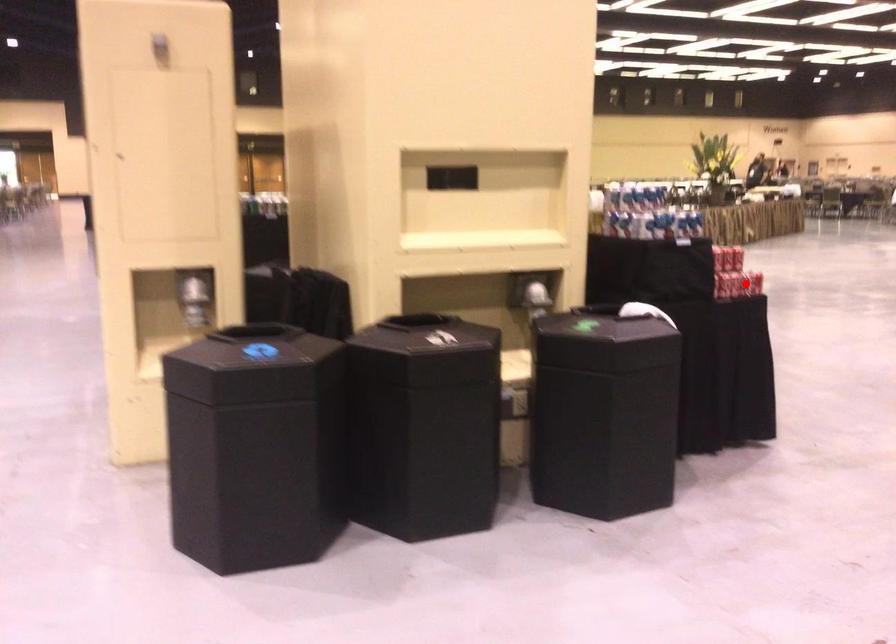
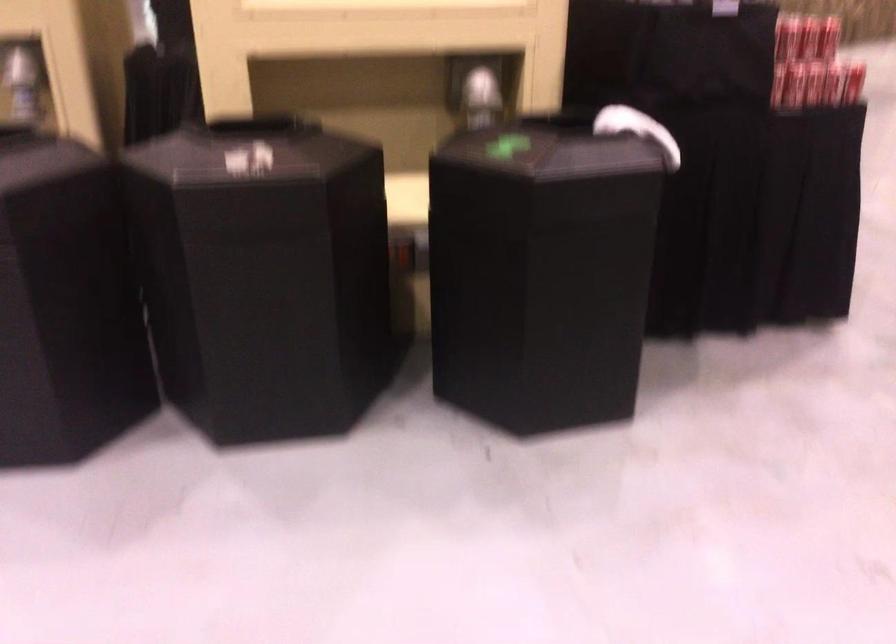
Question: I am providing you with two images of the same scene from different viewpoints. A red point is shown in image1. For the corresponding object point in image2, is it positioned nearer or farther from the camera?

Choices:
 (A) Nearer
 (B) Farther

Answer: (A)